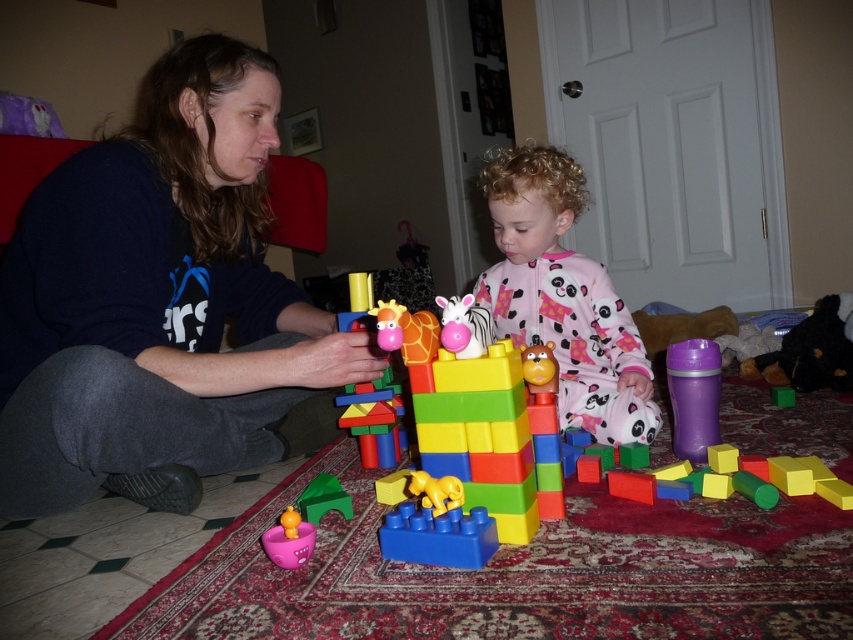
You are a delivery robot that is 1.5 meters tall. You need to deliver a package to a point exactly at the location of point (x=614, y=353). Can you reach that point without any obstruction?

The distance of point (x=614, y=353) from camera is 1.81 meters, so yes, the delivery robot can reach that point since it is within the robot height limit.

You are a parent trying to put away toys. You see the pink fleece pajamas at center and the matte plastic boat at lower left. Which item can you store in a small drawer without folding?

The matte plastic boat at lower left can be stored in a small drawer without folding because it is smaller in size compared to the pink fleece pajamas at center.

You are standing in the living room and want to pick up the matte black sweater at left. Where should you look to find it?

The matte black sweater at left is located at point (161, 304).